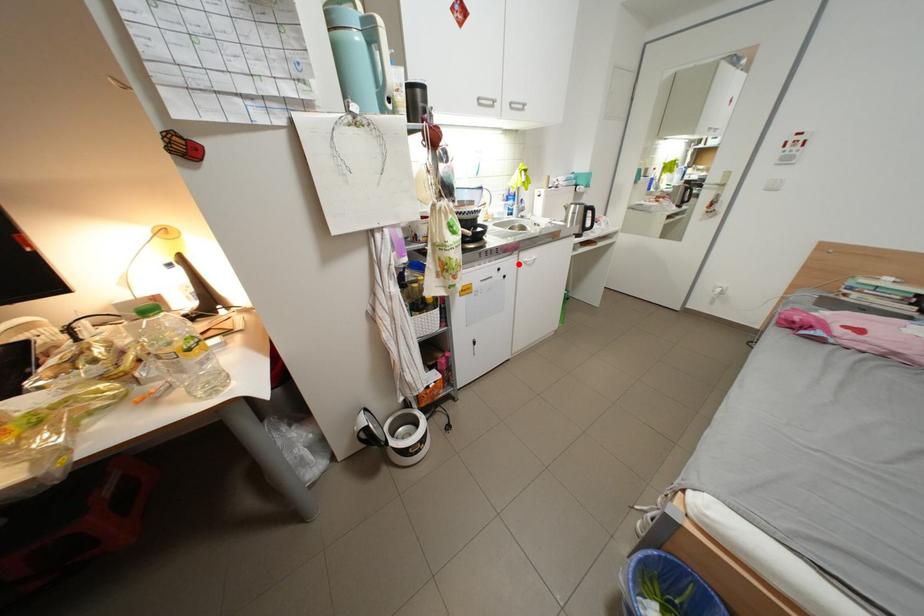
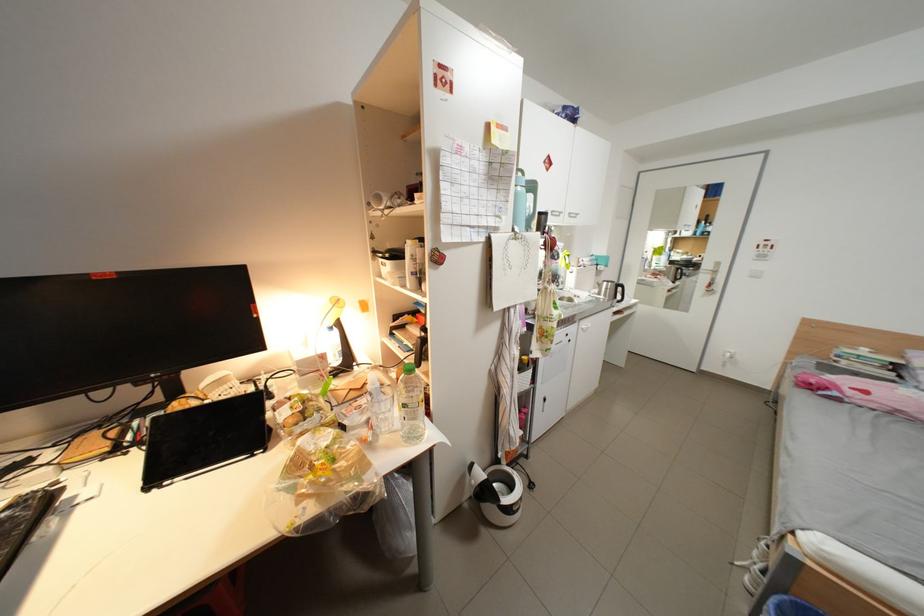
Question: A red point is marked in image1. In image2, is the corresponding 3D point closer to the camera or farther? Reply with the corresponding letter.

Choices:
 (A) The corresponding 3D point is closer.
 (B) The corresponding 3D point is farther.

Answer: (B)